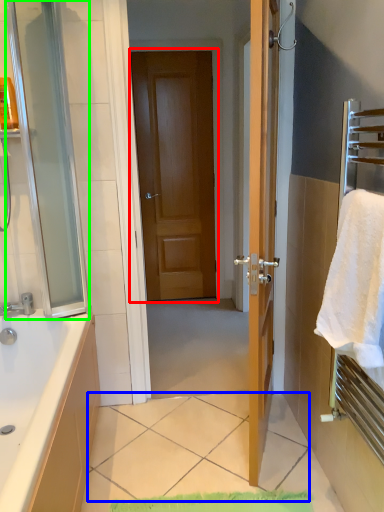
Question: Based on their relative distances, which object is nearer to door (highlighted by a red box)? Choose from tile (highlighted by a blue box) and screen door (highlighted by a green box).

Choices:
 (A) tile
 (B) screen door

Answer: (B)